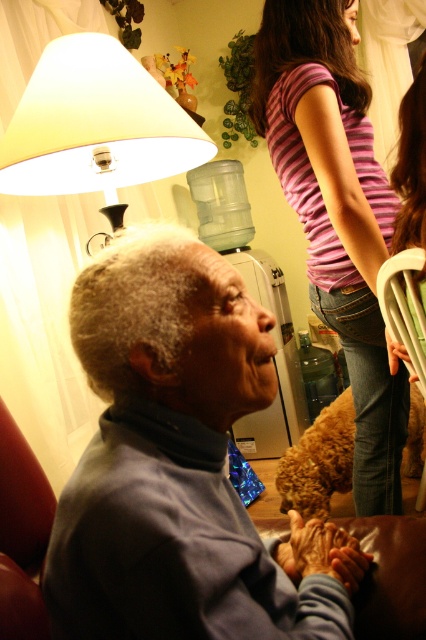
Question: Which point appears closest to the camera in this image?

Choices:
 (A) (57, 621)
 (B) (419, 352)
 (C) (363, 316)
 (D) (412, 166)

Answer: (A)

Question: Is striped cotton shirt at upper right below striped fabric shirt at upper center?

Choices:
 (A) yes
 (B) no

Answer: (A)

Question: Which is nearer to the white plastic chair at right?

Choices:
 (A) white matte lampshade at upper left
 (B) striped cotton shirt at upper right

Answer: (B)

Question: Does white matte lampshade at upper left have a greater width compared to striped fabric shirt at upper center?

Choices:
 (A) no
 (B) yes

Answer: (B)

Question: Observing the image, what is the correct spatial positioning of white matte lampshade at upper left in reference to white plastic chair at right?

Choices:
 (A) right
 (B) left

Answer: (B)

Question: Which of the following is the closest to the observer?

Choices:
 (A) white matte lampshade at upper left
 (B) white plastic chair at right

Answer: (B)